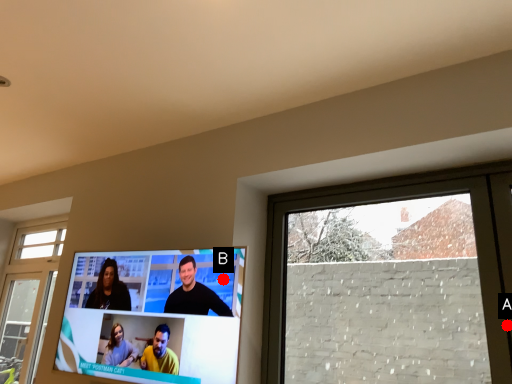
Question: Two points are circled on the image, labeled by A and B beside each circle. Which of the following is the farthest from the observer?

Choices:
 (A) A is further
 (B) B is further

Answer: (B)